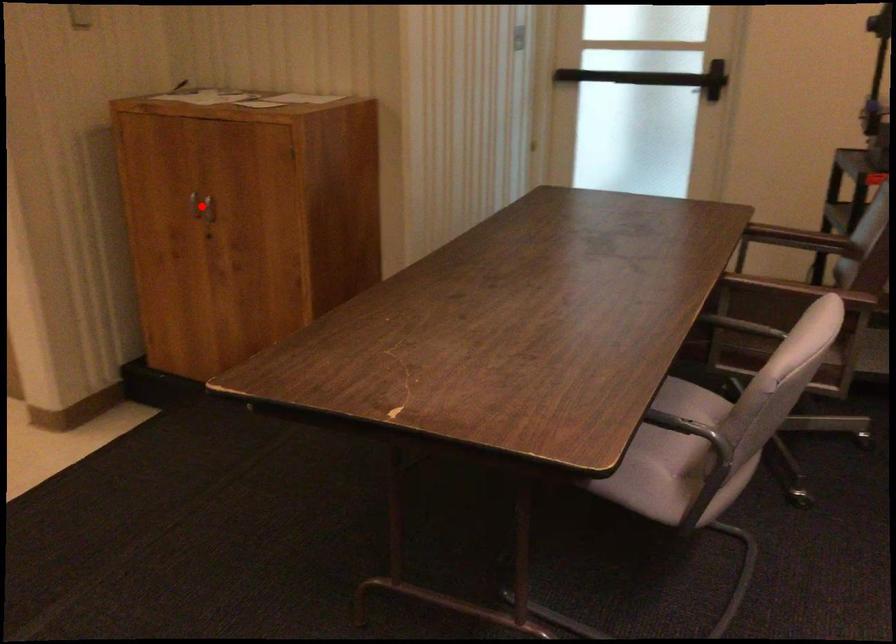
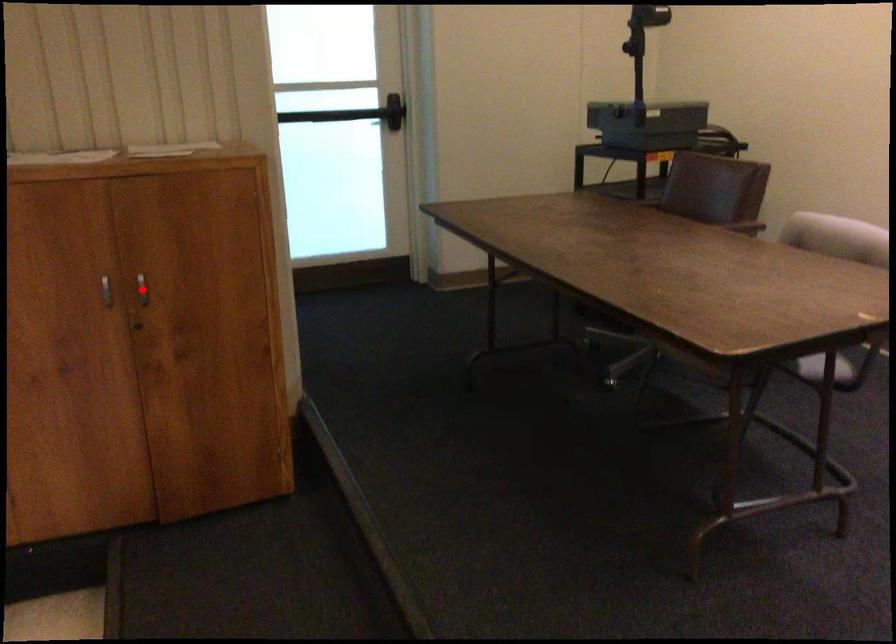
I am providing you with two images of the same scene from different viewpoints. A red point is marked on the first image and another point is marked on the second image. Do the highlighted points in image1 and image2 indicate the same real-world spot?

Yes